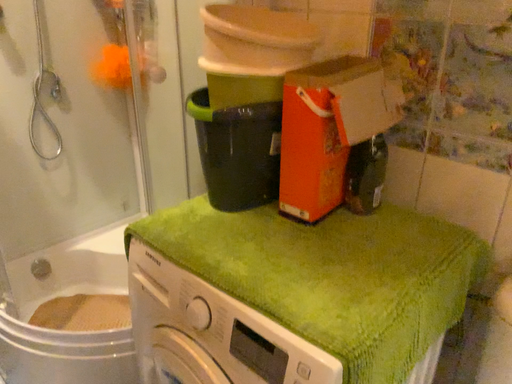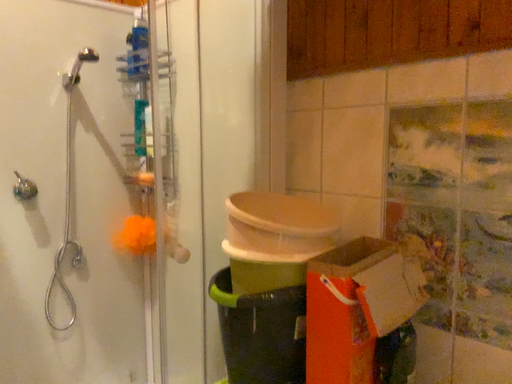
Question: How did the camera likely rotate when shooting the video?

Choices:
 (A) rotated upward
 (B) rotated downward

Answer: (A)